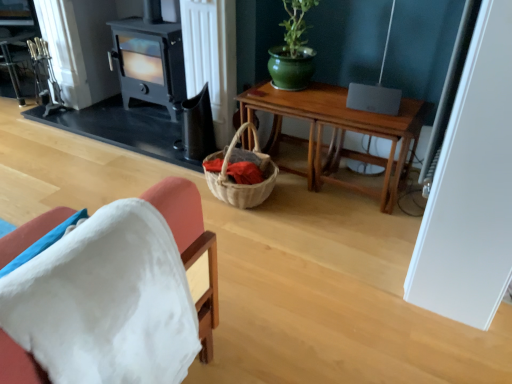
Describe the element at coordinates (149, 62) in the screenshot. I see `black matte fireplace at center` at that location.

Identify the location of black matte fireplace at center. (149, 62).

Where is `wooden table at center`? The height and width of the screenshot is (384, 512). wooden table at center is located at coordinates (337, 133).

Is white fabric chair at lower left oriented towards black matte fireplace at center?

No, white fabric chair at lower left is not facing towards black matte fireplace at center.

Is the position of white fabric chair at lower left less distant than that of black matte fireplace at center?

Yes.

Is white fabric chair at lower left wider or thinner than black matte fireplace at center?

Considering their sizes, white fabric chair at lower left looks broader than black matte fireplace at center.

Is black matte fireplace at center looking in the opposite direction of white fabric chair at lower left?

No.

Which object is more forward, black matte fireplace at center or white fabric chair at lower left?

Positioned in front is white fabric chair at lower left.

Is black matte fireplace at center shorter than white fabric chair at lower left?

Incorrect, the height of black matte fireplace at center does not fall short of that of white fabric chair at lower left.

Which is closer, (154, 69) or (27, 230)?

The point (27, 230) is in front.

Is black matte fireplace at center shorter than wooden table at center?

Incorrect, the height of black matte fireplace at center does not fall short of that of wooden table at center.

Based on their positions, is black matte fireplace at center located to the left or right of wooden table at center?

black matte fireplace at center is to the left of wooden table at center.

From the picture: Is black matte fireplace at center wider or thinner than wooden table at center?

Considering their sizes, black matte fireplace at center looks slimmer than wooden table at center.

Considering the sizes of objects wooden table at center and black matte fireplace at center in the image provided, who is thinner, wooden table at center or black matte fireplace at center?

black matte fireplace at center is thinner.

From a real-world perspective, is wooden table at center over black matte fireplace at center?

No, from a real-world perspective, wooden table at center is not above black matte fireplace at center.

Is wooden table at center looking in the opposite direction of black matte fireplace at center?

No.

Is wooden table at center not near black matte fireplace at center?

That's not correct — wooden table at center is a little close to black matte fireplace at center.

Who is smaller, white fabric chair at lower left or wooden table at center?

With smaller size is white fabric chair at lower left.

Considering the positions of objects white fabric chair at lower left and wooden table at center in the image provided, who is more to the left, white fabric chair at lower left or wooden table at center?

From the viewer's perspective, white fabric chair at lower left appears more on the left side.

How far apart are white fabric chair at lower left and wooden table at center?

They are 1.27 meters apart.

Is white fabric chair at lower left not inside wooden table at center?

That's correct, white fabric chair at lower left is outside of wooden table at center.

Is white fabric chair at lower left a part of wooden table at center?

No, white fabric chair at lower left is not inside wooden table at center.

In the scene shown: Which of these two, wooden table at center or white fabric chair at lower left, is thinner?

white fabric chair at lower left.

Is wooden table at center turned away from white fabric chair at lower left?

wooden table at center does not have its back to white fabric chair at lower left.

At what (x,y) coordinates should I click in order to perform the action: click on fireplace on the left of white fabric chair at lower left. Please return your answer as a coordinate pair (x, y). Looking at the image, I should click on (149, 62).

This screenshot has width=512, height=384. Find the location of `chair below the black matte fireplace at center (from the image's perspective)`. chair below the black matte fireplace at center (from the image's perspective) is located at coordinates (191, 246).

Consider the image. Looking at the image, which one is located further to black matte fireplace at center, white fabric chair at lower left or wooden table at center?

white fabric chair at lower left is further to black matte fireplace at center.

From the image, which object appears to be nearer to white fabric chair at lower left, wooden table at center or black matte fireplace at center?

Among the two, wooden table at center is located nearer to white fabric chair at lower left.

In the scene shown: Which object lies nearer to the anchor point wooden table at center, white fabric chair at lower left or black matte fireplace at center?

The object closer to wooden table at center is black matte fireplace at center.

Estimate the real-world distances between objects in this image. Which object is closer to wooden table at center, black matte fireplace at center or white fabric chair at lower left?

black matte fireplace at center.

Considering their positions, is black matte fireplace at center positioned closer to white fabric chair at lower left than wooden table at center?

wooden table at center.

When comparing their distances from black matte fireplace at center, does wooden table at center or white fabric chair at lower left seem further?

Based on the image, white fabric chair at lower left appears to be further to black matte fireplace at center.

This screenshot has height=384, width=512. What are the coordinates of `table positioned between white fabric chair at lower left and black matte fireplace at center from near to far` in the screenshot? It's located at (337, 133).